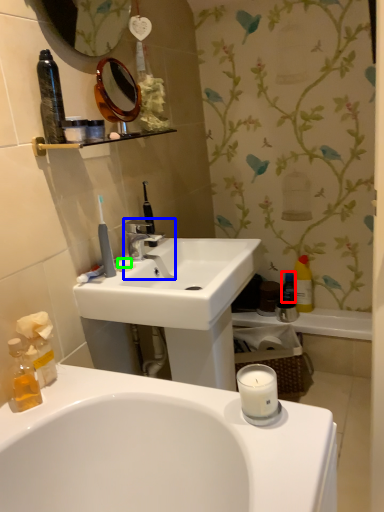
Question: Which object is the farthest from mouthwash (highlighted by a red box)? Choose among these: tap (highlighted by a blue box) or soap (highlighted by a green box).

Choices:
 (A) tap
 (B) soap

Answer: (B)